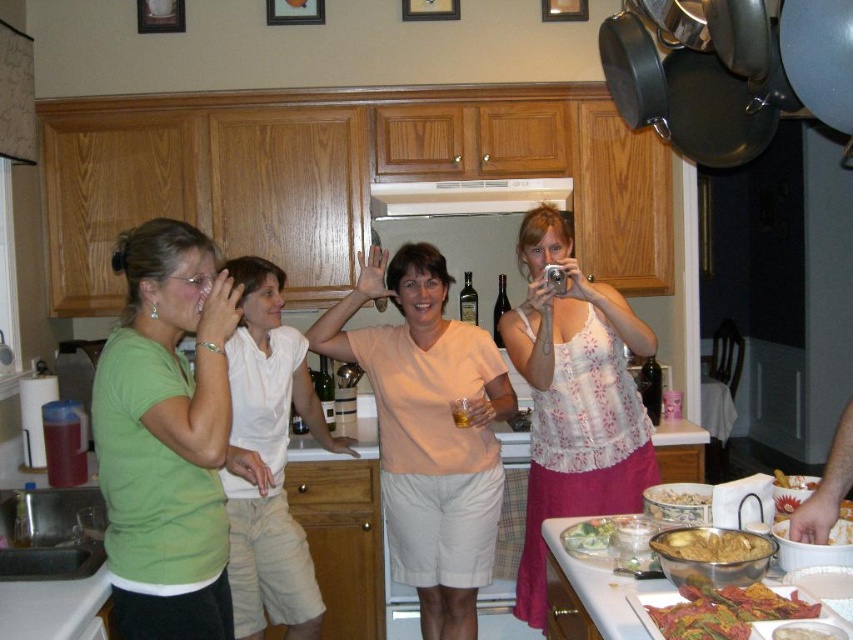
You are a guest at this gathering and want to place a small plate on the shiny metallic bowl at center. However, there is a white cotton shirt at center nearby. Based on the scene, can you determine if the shirt is in the way of placing the plate on the bowl?

The white cotton shirt at center is located above the shiny metallic bowl at center, so placing the plate on the bowl may be obstructed by the shirt.

You are a chef preparing to place a shiny metallic bowl at center right on the counter. However, there is a white matte exhaust hood at center in the way. Can you move the bowl to the front so it is no longer obstructed by the hood?

The shiny metallic bowl at center right is currently behind the white matte exhaust hood at center, so yes, moving it to the front would make it no longer obstructed by the hood.

You are a guest at the gathering and want to place a small plate between the white cotton shirt at center and the shiny metallic bowl at center. Which object should you place it closer to if you want the plate to be lower?

You should place the small plate closer to the shiny metallic bowl at center because the white cotton shirt at center is taller than the shiny metallic bowl at center, making the bowl the lower object.